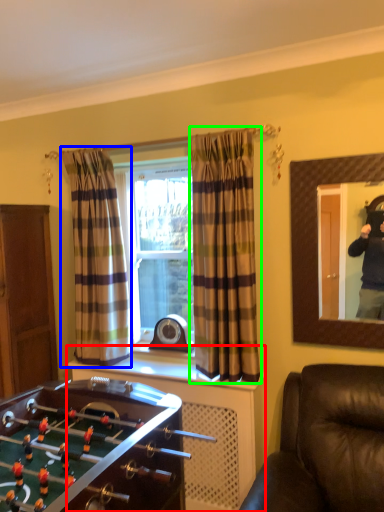
Question: Which object is the closest to the dresser (highlighted by a red box)? Choose among these: curtain (highlighted by a blue box) or curtain (highlighted by a green box).

Choices:
 (A) curtain
 (B) curtain

Answer: (B)